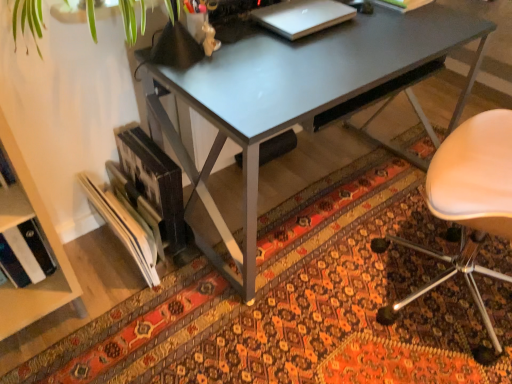
Question: Relative to sleek silver laptop at upper center, is beige leather chair at right in front or behind?

Choices:
 (A) behind
 (B) front

Answer: (B)

Question: Considering the positions of beige leather chair at right and sleek silver laptop at upper center in the image, is beige leather chair at right wider or thinner than sleek silver laptop at upper center?

Choices:
 (A) wide
 (B) thin

Answer: (A)

Question: Estimate the real-world distances between objects in this image. Which object is farther from the hardcover book at upper center?

Choices:
 (A) sleek silver laptop at upper center
 (B) metallic gray desk at center
 (C) patterned carpet at lower center
 (D) beige leather chair at right

Answer: (C)

Question: Which is nearer to the metallic gray desk at center?

Choices:
 (A) patterned carpet at lower center
 (B) beige leather chair at right
 (C) sleek silver laptop at upper center
 (D) hardcover book at upper center

Answer: (C)